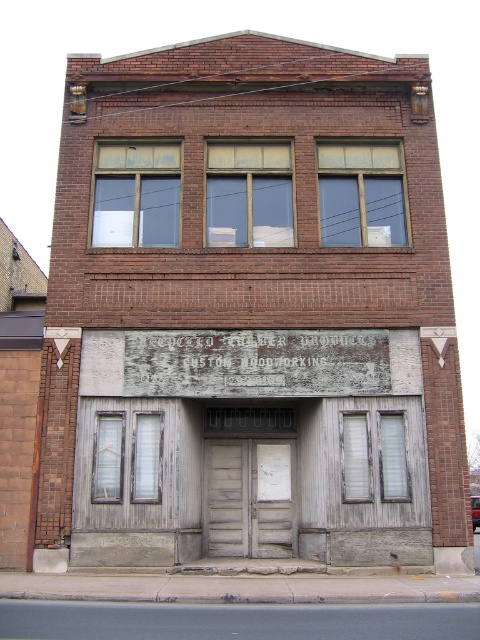
Question: Does matte glass window at center come behind greenish glass window at upper center?

Choices:
 (A) no
 (B) yes

Answer: (B)

Question: Does weathered wood door at center appear on the right side of greenish glass window at upper center?

Choices:
 (A) no
 (B) yes

Answer: (B)

Question: Which point is closer to the camera?

Choices:
 (A) (404, 202)
 (B) (399, 449)
 (C) (260, 540)

Answer: (B)

Question: Is weathered wood door at center positioned before greenish glass window at upper center?

Choices:
 (A) yes
 (B) no

Answer: (A)

Question: Which object is the farthest from the matte glass window at center?

Choices:
 (A) wooden at center
 (B) matte wooden window at center
 (C) greenish glass window at upper center
 (D) weathered wood door at center

Answer: (D)

Question: Which point appears farthest from the camera in this image?

Choices:
 (A) (362, 216)
 (B) (386, 444)
 (C) (245, 218)

Answer: (C)